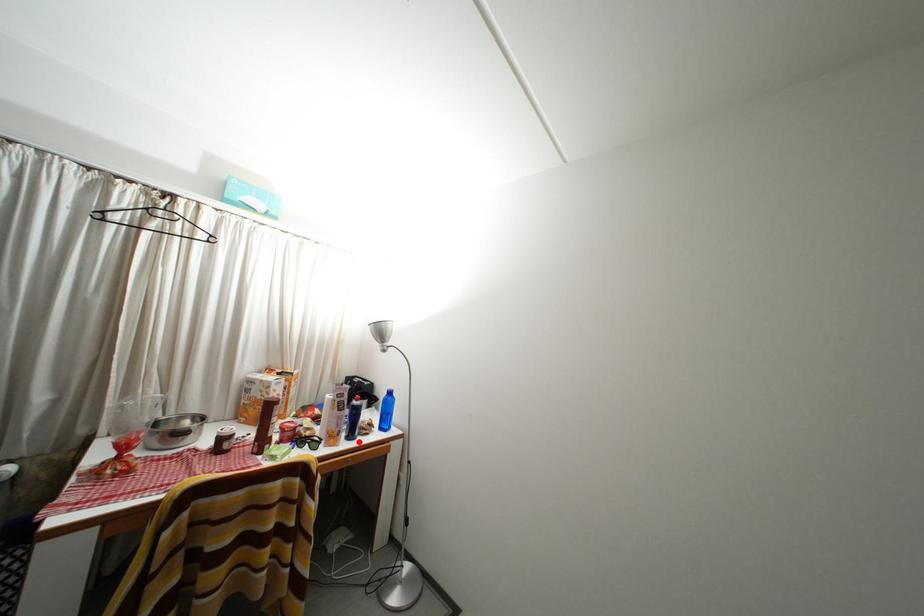
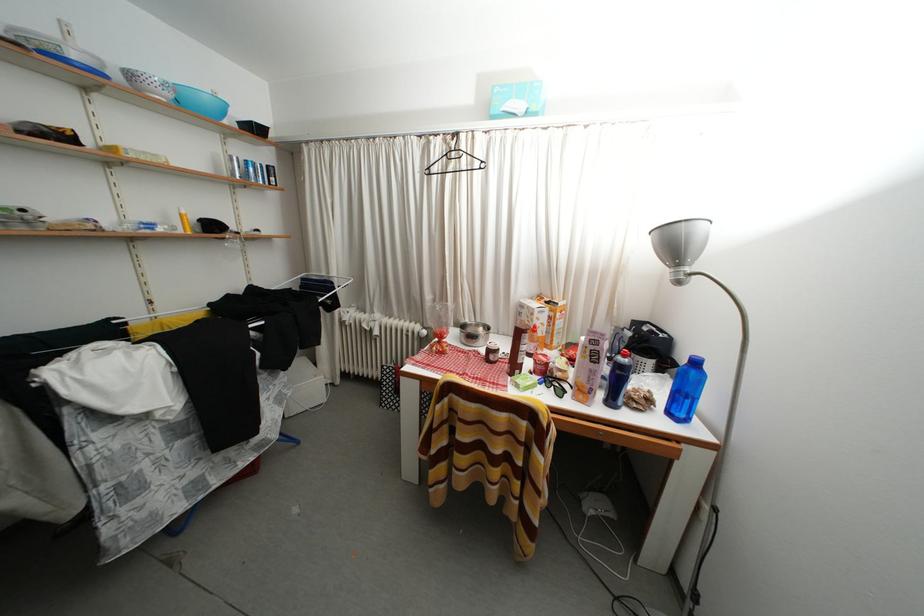
The point at the highlighted location is marked in the first image. Where is the corresponding point in the second image?

(618, 408)